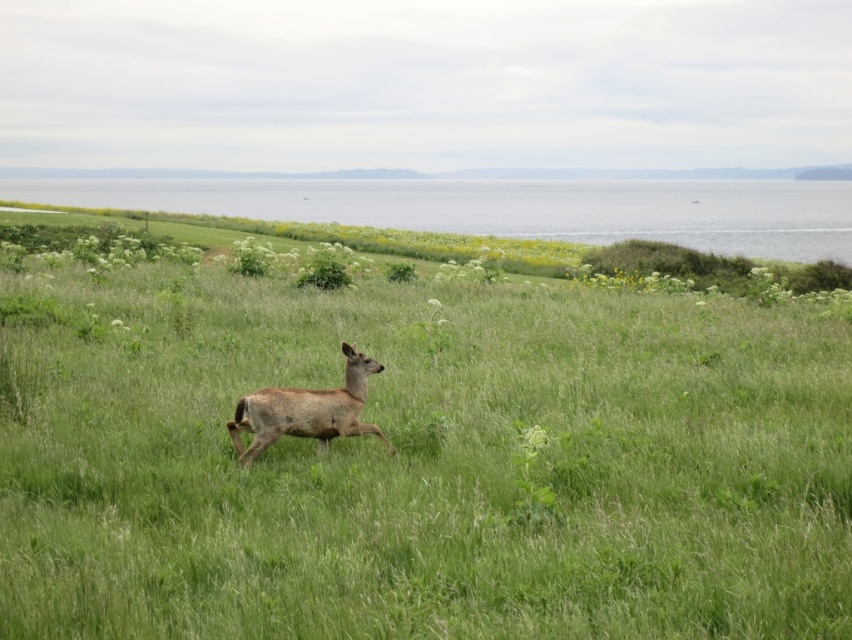
Question: Does green grassy field at center lie behind gray water at upper center?

Choices:
 (A) no
 (B) yes

Answer: (A)

Question: Estimate the real-world distances between objects in this image. Which object is closer to the gray water at upper center?

Choices:
 (A) brown fur deer at center
 (B) green grassy field at center

Answer: (B)

Question: Does green grassy field at center have a smaller size compared to gray water at upper center?

Choices:
 (A) no
 (B) yes

Answer: (B)

Question: Which of the following is the farthest from the observer?

Choices:
 (A) brown fur deer at center
 (B) green grassy field at center
 (C) gray water at upper center

Answer: (C)

Question: Which object is positioned closest to the gray water at upper center?

Choices:
 (A) brown fur deer at center
 (B) green grassy field at center

Answer: (B)

Question: Is green grassy field at center thinner than gray water at upper center?

Choices:
 (A) yes
 (B) no

Answer: (A)